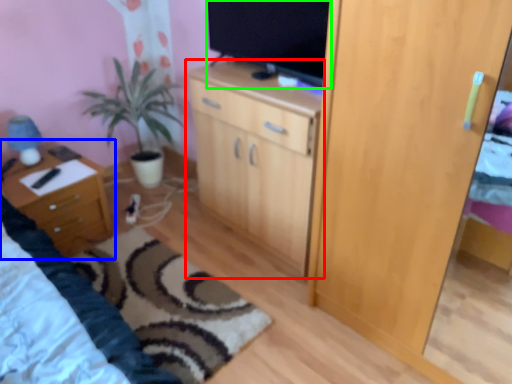
Question: Based on their relative distances, which object is farther from cabinetry (highlighted by a red box)? Choose from nightstand (highlighted by a blue box) and television (highlighted by a green box).

Choices:
 (A) nightstand
 (B) television

Answer: (A)